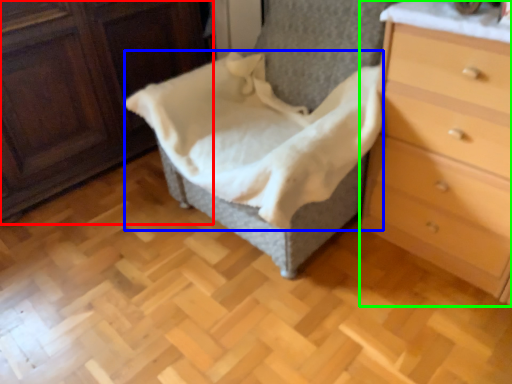
Question: Considering the real-world distances, which object is farthest from furniture (highlighted by a red box)? blanket (highlighted by a blue box) or chest of drawers (highlighted by a green box)?

Choices:
 (A) blanket
 (B) chest of drawers

Answer: (B)